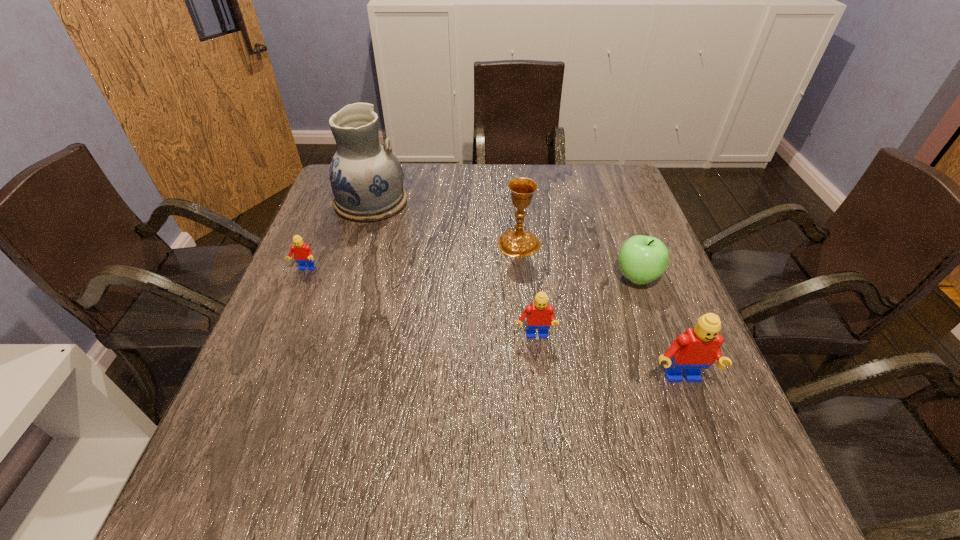
The width and height of the screenshot is (960, 540). What are the coordinates of `free spot between the second Lego from left to right and the tallest Lego` in the screenshot? It's located at (607, 359).

Find the location of a particular element. This screenshot has width=960, height=540. free space that is in between the second Lego from left to right and the pottery is located at coordinates [453, 270].

At what (x,y) coordinates should I click in order to perform the action: click on blank region between the shortest Lego and the nearest Lego. Please return your answer as a coordinate pair (x, y). This screenshot has height=540, width=960. Looking at the image, I should click on (492, 325).

This screenshot has width=960, height=540. I want to click on free space between the leftmost Lego and the rightmost Lego, so click(x=492, y=325).

Where is `unoccupied position between the farthest object and the nearest object`? unoccupied position between the farthest object and the nearest object is located at coordinates [525, 291].

The image size is (960, 540). I want to click on empty space that is in between the second tallest Lego and the leftmost Lego, so click(x=420, y=303).

At what (x,y) coordinates should I click in order to perform the action: click on vacant space that's between the second farthest Lego and the farthest object. Please return your answer as a coordinate pair (x, y). Looking at the image, I should click on (x=453, y=270).

What are the coordinates of `unoccupied area between the second shortest Lego and the chalice` in the screenshot? It's located at (527, 291).

This screenshot has width=960, height=540. Identify the location of free space between the nearest object and the second Lego from right to left. click(x=607, y=359).

Choose which object is the fifth nearest neighbor to the second farthest object. Please provide its 2D coordinates. Your answer should be formatted as a tuple, i.e. [(x, y)], where the tuple contains the x and y coordinates of a point satisfying the conditions above.

[(302, 253)]